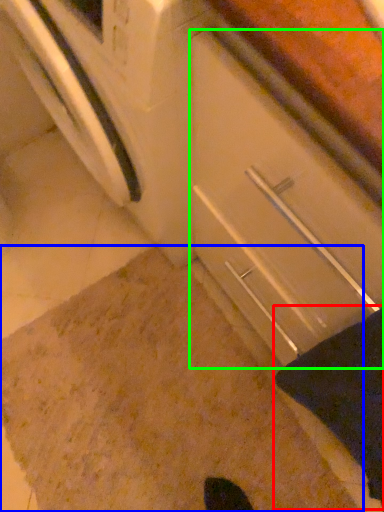
Question: Based on their relative distances, which object is farther from blanket (highlighted by a red box)? Choose from granite (highlighted by a blue box) and drawer (highlighted by a green box).

Choices:
 (A) granite
 (B) drawer

Answer: (A)